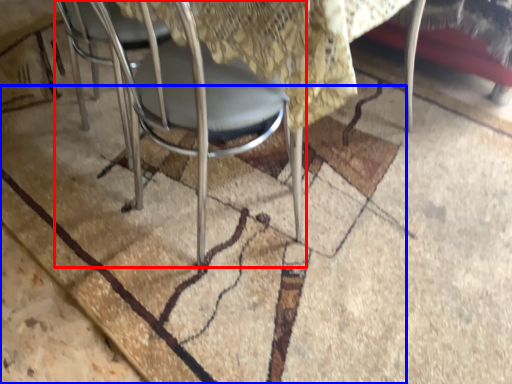
Question: Which object is closer to the camera taking this photo, chair (highlighted by a red box) or mat (highlighted by a blue box)?

Choices:
 (A) chair
 (B) mat

Answer: (A)